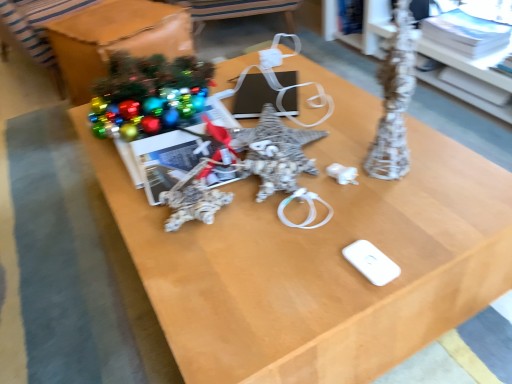
What is the approximate height of white matte ipod at lower right?

white matte ipod at lower right is 0.58 inches tall.

Where is `white matte ipod at lower right`? white matte ipod at lower right is located at coordinates (371, 262).

This screenshot has height=384, width=512. Describe the element at coordinates (371, 262) in the screenshot. I see `white matte ipod at lower right` at that location.

Where is `white matte ipod at lower right`? This screenshot has width=512, height=384. white matte ipod at lower right is located at coordinates (371, 262).